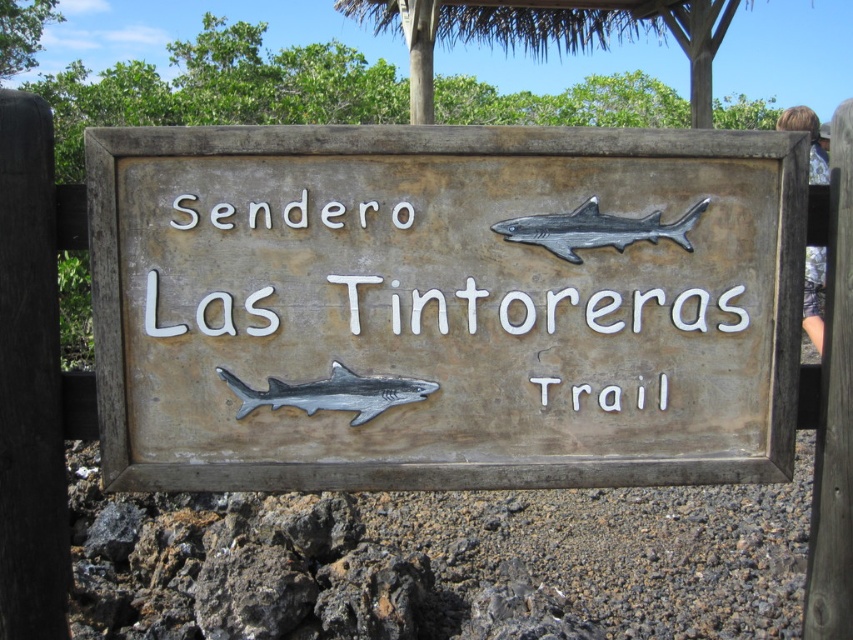
Question: Can you confirm if weathered wood sign at center is positioned to the left of gray metallic shark at center?

Choices:
 (A) no
 (B) yes

Answer: (A)

Question: Among these points, which one is nearest to the camera?

Choices:
 (A) (416, 388)
 (B) (569, 220)
 (C) (141, 317)

Answer: (B)

Question: Which is farther from the gray metallic shark at center?

Choices:
 (A) metallic gray shark at upper center
 (B) weathered wood sign at center

Answer: (A)

Question: Considering the real-world distances, which object is farthest from the metallic gray shark at upper center?

Choices:
 (A) gray metallic shark at center
 (B) weathered wood sign at center

Answer: (A)

Question: Is weathered wood sign at center below gray metallic shark at center?

Choices:
 (A) yes
 (B) no

Answer: (B)

Question: Can you confirm if metallic gray shark at upper center is smaller than gray metallic shark at center?

Choices:
 (A) no
 (B) yes

Answer: (A)